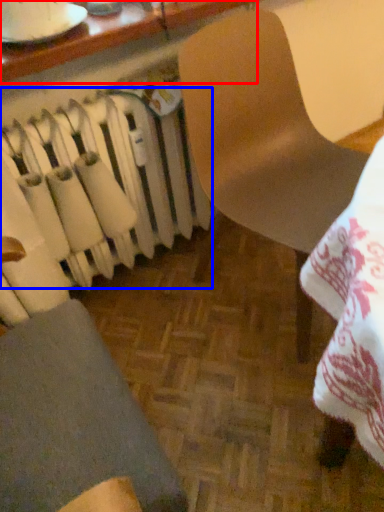
Question: Which of the following is the closest to the observer, table (highlighted by a red box) or radiator (highlighted by a blue box)?

Choices:
 (A) table
 (B) radiator

Answer: (A)